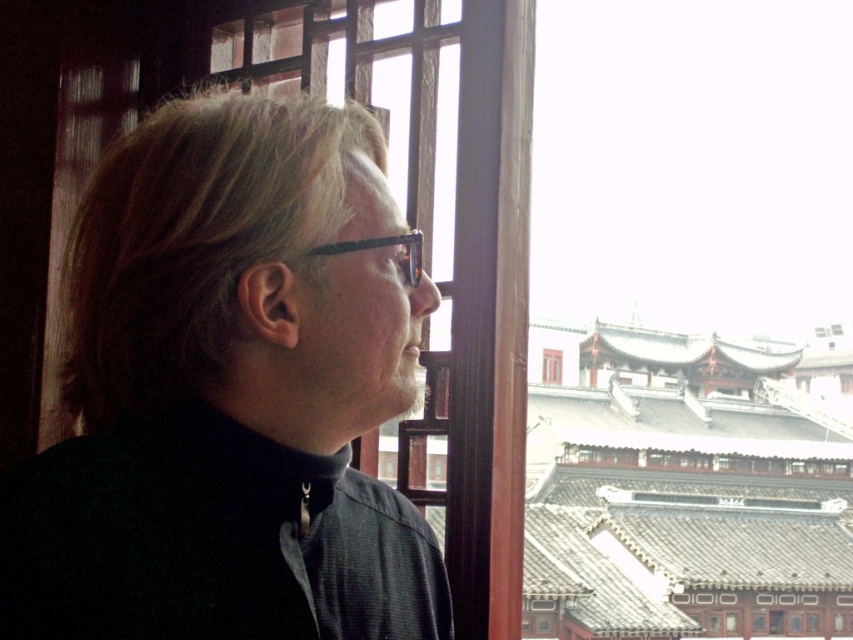
Question: Is black matte jacket at center behind transparent plastic glasses at center?

Choices:
 (A) no
 (B) yes

Answer: (B)

Question: Among these objects, which one is nearest to the camera?

Choices:
 (A) black matte jacket at center
 (B) transparent plastic glasses at center

Answer: (B)

Question: Which point appears closest to the camera in this image?

Choices:
 (A) [x=338, y=250]
 (B) [x=437, y=588]

Answer: (A)

Question: Is black matte jacket at center behind transparent plastic glasses at center?

Choices:
 (A) yes
 (B) no

Answer: (A)

Question: Which point appears closest to the camera in this image?

Choices:
 (A) (415, 264)
 (B) (321, 534)

Answer: (B)

Question: In this image, where is black matte jacket at center located relative to transparent plastic glasses at center?

Choices:
 (A) below
 (B) above

Answer: (A)